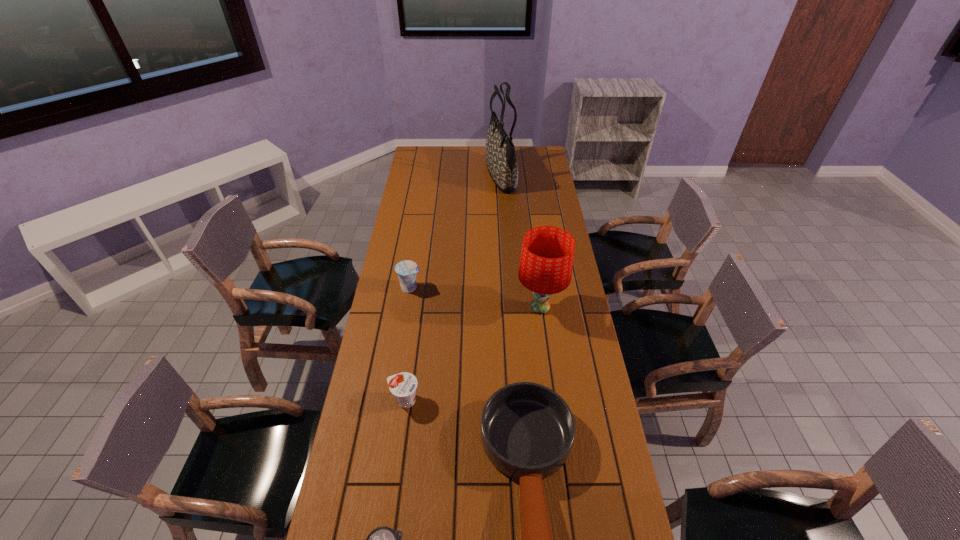
Identify the location of the farthest object. The image size is (960, 540). (500, 155).

Image resolution: width=960 pixels, height=540 pixels. Find the location of `tote bag`. tote bag is located at coordinates coord(500,155).

You are a GUI agent. You are given a task and a screenshot of the screen. Output one action in this format:
    pyautogui.click(x=<x>, y=<y>)
    Task: Click on the second tallest object
    This screenshot has height=540, width=960.
    Given the screenshot: What is the action you would take?
    pyautogui.click(x=546, y=262)

Find the location of a particular element. This screenshot has height=540, width=960. the tallest yogurt is located at coordinates (406, 270).

The width and height of the screenshot is (960, 540). I want to click on the second nearest yogurt, so click(403, 385).

What are the coordinates of `vacant space located on the right of the tote bag` in the screenshot? It's located at (553, 175).

The image size is (960, 540). What are the coordinates of `vacant space located 0.390m on the front-facing side of the lampshade` in the screenshot? It's located at (414, 307).

The height and width of the screenshot is (540, 960). Find the location of `blank space located on the front-facing side of the lampshade`. blank space located on the front-facing side of the lampshade is located at coordinates (468, 307).

Where is `vacant space located on the front-facing side of the lampshade`? Image resolution: width=960 pixels, height=540 pixels. vacant space located on the front-facing side of the lampshade is located at coordinates (461, 307).

I want to click on free space located on the front of the tallest yogurt, so click(398, 365).